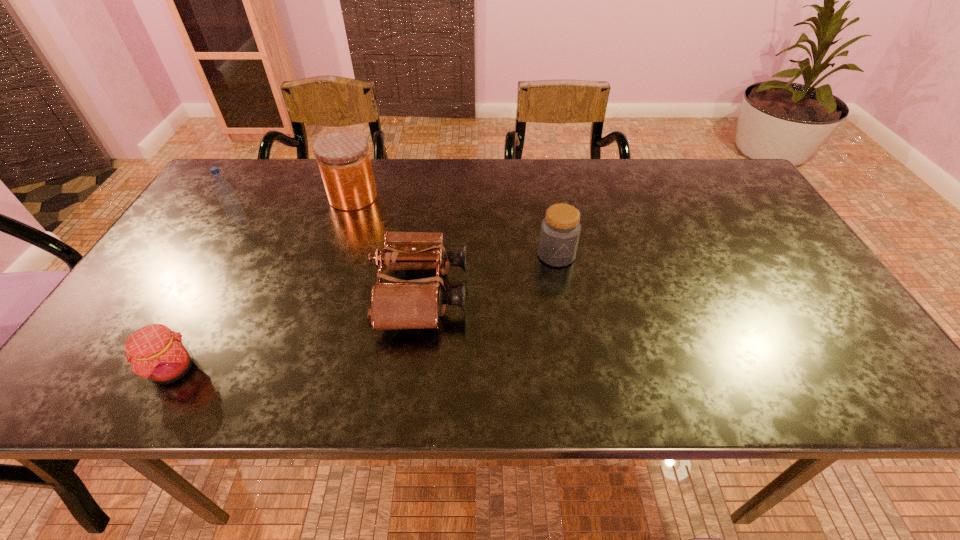
Identify the location of the left jar. This screenshot has height=540, width=960. (343, 158).

Locate an element on the screen. The width and height of the screenshot is (960, 540). the farther jar is located at coordinates (343, 158).

The width and height of the screenshot is (960, 540). Find the location of `water bottle`. water bottle is located at coordinates [223, 189].

This screenshot has width=960, height=540. Identify the location of the shorter jar. pos(560,229).

This screenshot has width=960, height=540. I want to click on the rightmost object, so click(x=560, y=229).

The width and height of the screenshot is (960, 540). I want to click on binoculars, so click(x=402, y=304).

This screenshot has height=540, width=960. I want to click on jam, so click(156, 353).

At what (x,y) coordinates should I click in order to perform the action: click on the nearest object. Please return your answer as a coordinate pair (x, y). Looking at the image, I should click on (156, 353).

Identify the location of free point located 0.300m on the front of the farther jar. (322, 291).

The image size is (960, 540). I want to click on free space located on the right of the water bottle, so click(x=306, y=222).